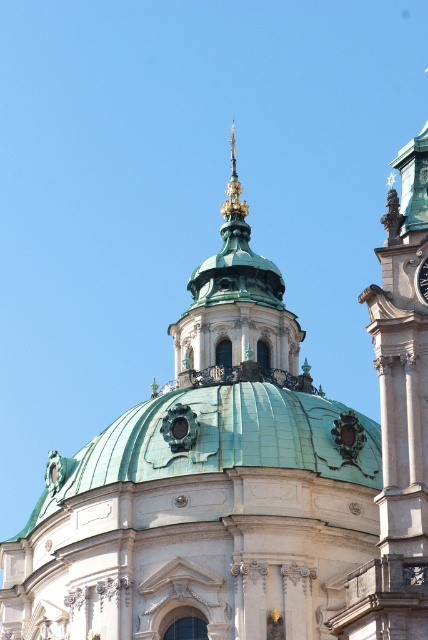
Can you confirm if green copper dome at center is wider than metallic silver clock at upper center?

Indeed, green copper dome at center has a greater width compared to metallic silver clock at upper center.

Which of these two, green copper dome at center or metallic silver clock at upper center, stands shorter?

metallic silver clock at upper center

Which is behind, point (80, 472) or point (419, 268)?

The point (80, 472) is behind.

I want to click on green copper dome at center, so click(219, 440).